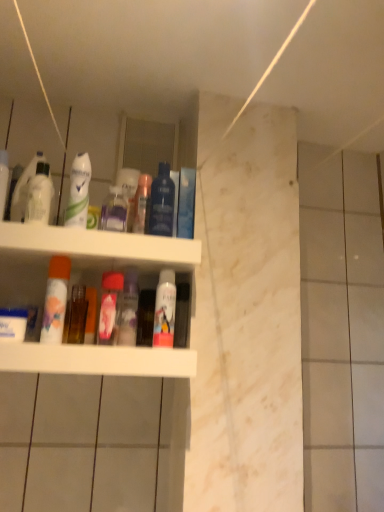
What do you see at coordinates (186, 203) in the screenshot? I see `blue glossy box at upper center, the 1th toiletry positioned from the right` at bounding box center [186, 203].

Where is `translucent plastic bottle at center, acting as the second toiletry starting from the left`? The image size is (384, 512). translucent plastic bottle at center, acting as the second toiletry starting from the left is located at coordinates (141, 203).

This screenshot has width=384, height=512. What do you see at coordinates (55, 300) in the screenshot?
I see `white glossy mouthwash at center, the 2th mouthwash viewed from the left` at bounding box center [55, 300].

This screenshot has width=384, height=512. I want to click on white glossy mouthwash at upper left, marked as the first mouthwash in a left-to-right arrangement, so coord(39,195).

The image size is (384, 512). In order to click on white plastic shelf at center in this screenshot , I will do 82,257.

This screenshot has height=512, width=384. What are the coordinates of `blue glossy box at upper center, the third toiletry when ordered from left to right` in the screenshot? It's located at (186, 203).

Is pink matte spray can at center, acting as the third toiletry starting from the right, bigger or smaller than white plastic shelf at center?

Considering their sizes, pink matte spray can at center, acting as the third toiletry starting from the right, takes up less space than white plastic shelf at center.

Visually, is pink matte spray can at center, acting as the third toiletry starting from the right, positioned to the left or to the right of white plastic shelf at center?

Based on their positions, pink matte spray can at center, acting as the third toiletry starting from the right, is located to the right of white plastic shelf at center.

Looking at this image, which of these two, pink matte spray can at center, which is the first toiletry in left-to-right order, or white plastic shelf at center, is thinner?

pink matte spray can at center, which is the first toiletry in left-to-right order.

Is point (31, 254) in front of point (117, 220)?

No.

Is white plastic shelf at center facing away from transparent plastic bottle at upper center, the 1th cleaning product when ordered from back to front?

No, white plastic shelf at center is not facing away from transparent plastic bottle at upper center, the 1th cleaning product when ordered from back to front.

Is white plastic shelf at center located outside transparent plastic bottle at upper center, positioned as the 1th cleaning product in right-to-left order?

Yes.

Does white plastic shelf at center have a larger size compared to transparent plastic bottle at upper center, the 2th cleaning product positioned from the left?

Indeed, white plastic shelf at center has a larger size compared to transparent plastic bottle at upper center, the 2th cleaning product positioned from the left.

Is transparent plastic bottle at upper center, the 2th cleaning product positioned from the left, located outside blue glossy mouthwash at upper center, acting as the 4th mouthwash starting from the left?

That's correct, transparent plastic bottle at upper center, the 2th cleaning product positioned from the left, is outside of blue glossy mouthwash at upper center, acting as the 4th mouthwash starting from the left.

Which object is more forward, transparent plastic bottle at upper center, placed as the second cleaning product when sorted from front to back, or blue glossy mouthwash at upper center, acting as the 4th mouthwash starting from the left?

blue glossy mouthwash at upper center, acting as the 4th mouthwash starting from the left, is more forward.

Which object is thinner, transparent plastic bottle at upper center, placed as the second cleaning product when sorted from front to back, or blue glossy mouthwash at upper center, acting as the 4th mouthwash starting from the left?

With smaller width is transparent plastic bottle at upper center, placed as the second cleaning product when sorted from front to back.

Does point (123, 200) come closer to viewer compared to point (157, 197)?

That is False.

Consider the image. From a real-world perspective, which object rests below the other?

In real-world perspective, pink matte spray can at center, which is the first toiletry in left-to-right order, is lower.

Would you say white glossy deodorant at upper left, which ranks as the first cleaning product in left-to-right order, is a long distance from pink matte spray can at center, which is the first toiletry in left-to-right order?

white glossy deodorant at upper left, which ranks as the first cleaning product in left-to-right order, is near pink matte spray can at center, which is the first toiletry in left-to-right order, not far away.

Would you say white glossy deodorant at upper left, the 2th cleaning product in the right-to-left sequence, is inside or outside pink matte spray can at center, acting as the third toiletry starting from the right?

The correct answer is: outside.

Locate an element on the screen. The width and height of the screenshot is (384, 512). the 1st cleaning product below the blue glossy box at upper center, the 1th toiletry positioned from the right (from a real-world perspective) is located at coordinates (78, 191).

Between white glossy deodorant at upper left, the 2th cleaning product in the right-to-left sequence, and blue glossy box at upper center, the third toiletry when ordered from left to right, which one is positioned in front?

Positioned in front is white glossy deodorant at upper left, the 2th cleaning product in the right-to-left sequence.

From a real-world perspective, between white glossy deodorant at upper left, the 2th cleaning product in the right-to-left sequence, and blue glossy box at upper center, the 1th toiletry positioned from the right, who is vertically lower?

From a 3D spatial view, white glossy deodorant at upper left, the 2th cleaning product in the right-to-left sequence, is below.

Is blue glossy box at upper center, the third toiletry when ordered from left to right, surrounded by white glossy deodorant at upper left, marked as the 1th cleaning product in a front-to-back arrangement?

No, blue glossy box at upper center, the third toiletry when ordered from left to right, is not surrounded by white glossy deodorant at upper left, marked as the 1th cleaning product in a front-to-back arrangement.

In order to click on the 1st mouthwash in front of the translucent plastic bottle at center, acting as the second toiletry starting from the left, starting your count from the anchor in this screenshot , I will do `click(39, 195)`.

From the image's perspective, which one is positioned lower, white glossy mouthwash at upper left, marked as the first mouthwash in a left-to-right arrangement, or translucent plastic bottle at center, the second toiletry from the right?

translucent plastic bottle at center, the second toiletry from the right, is shown below in the image.

What's the angular difference between white glossy mouthwash at upper left, which is the fifth mouthwash from right to left, and translucent plastic bottle at center, the second toiletry from the right,'s facing directions?

The facing directions of white glossy mouthwash at upper left, which is the fifth mouthwash from right to left, and translucent plastic bottle at center, the second toiletry from the right, are 6.64e-05 degrees apart.

Is white glossy mouthwash at upper left, which is the fifth mouthwash from right to left, touching translucent plastic bottle at center, acting as the second toiletry starting from the left?

A: There is a gap between white glossy mouthwash at upper left, which is the fifth mouthwash from right to left, and translucent plastic bottle at center, acting as the second toiletry starting from the left.

From the image's perspective, between white glossy mouthwash at center, which ranks as the 4th mouthwash in right-to-left order, and white glossy deodorant at upper left, acting as the second cleaning product starting from the back, who is located below?

white glossy mouthwash at center, which ranks as the 4th mouthwash in right-to-left order, from the image's perspective.

Looking at this image, from a real-world perspective, does white glossy mouthwash at center, the 2th mouthwash viewed from the left, stand above white glossy deodorant at upper left, marked as the 1th cleaning product in a front-to-back arrangement?

No.

Locate an element on the screen. mouthwash that is the 1st one when counting forward from the white glossy deodorant at upper left, acting as the second cleaning product starting from the back is located at coordinates (55, 300).

Which is more to the left, white glossy mouthwash at center, which ranks as the 4th mouthwash in right-to-left order, or white glossy deodorant at upper left, the 2th cleaning product in the right-to-left sequence?

From the viewer's perspective, white glossy mouthwash at center, which ranks as the 4th mouthwash in right-to-left order, appears more on the left side.

Which toiletry is the 1st one when counting from the right side of the white plastic shelf at center? Please provide its 2D coordinates.

[(129, 310)]

Where is `the 1st cleaning product directly above the white plastic shelf at center (from a real-world perspective)`? Image resolution: width=384 pixels, height=512 pixels. the 1st cleaning product directly above the white plastic shelf at center (from a real-world perspective) is located at coordinates (114, 211).

Considering their positions, is transparent plastic bottle at upper center, positioned as the 1th cleaning product in right-to-left order, positioned further to translucent plastic bottle at center, acting as the second toiletry starting from the left, than blue glossy mouthwash at upper center, acting as the 4th mouthwash starting from the left?

The object further to translucent plastic bottle at center, acting as the second toiletry starting from the left, is transparent plastic bottle at upper center, positioned as the 1th cleaning product in right-to-left order.

From the picture: Which object lies nearer to the anchor point blue glossy mouthwash at upper center, acting as the 4th mouthwash starting from the left, pink glossy mouthwash at center, the third mouthwash viewed from the left, or white glossy mouthwash at upper left, which is the fifth mouthwash from right to left?

The object closer to blue glossy mouthwash at upper center, acting as the 4th mouthwash starting from the left, is pink glossy mouthwash at center, the third mouthwash viewed from the left.

Estimate the real-world distances between objects in this image. Which object is further from translucent plastic bottle at center, the second toiletry from the right, pink glossy mouthwash at center, the third mouthwash viewed from the left, or white glossy mouthwash at center, the 2th mouthwash viewed from the left?

The object further to translucent plastic bottle at center, the second toiletry from the right, is white glossy mouthwash at center, the 2th mouthwash viewed from the left.

Considering their positions, is blue glossy box at upper center, the 1th toiletry positioned from the right, positioned closer to white matte mouthwash at center, which appears as the first mouthwash when viewed from the right, than pink matte spray can at center, which is the first toiletry in left-to-right order?

pink matte spray can at center, which is the first toiletry in left-to-right order, is positioned closer to the anchor white matte mouthwash at center, which appears as the first mouthwash when viewed from the right.

Looking at the image, which one is located further to blue glossy box at upper center, the 1th toiletry positioned from the right, transparent plastic bottle at upper center, the 2th cleaning product positioned from the left, or translucent plastic bottle at center, acting as the second toiletry starting from the left?

transparent plastic bottle at upper center, the 2th cleaning product positioned from the left, is further to blue glossy box at upper center, the 1th toiletry positioned from the right.

Estimate the real-world distances between objects in this image. Which object is closer to transparent plastic bottle at upper center, the 2th cleaning product positioned from the left, blue glossy box at upper center, the 1th toiletry positioned from the right, or pink matte spray can at center, which is the first toiletry in left-to-right order?

blue glossy box at upper center, the 1th toiletry positioned from the right, lies closer to transparent plastic bottle at upper center, the 2th cleaning product positioned from the left, than the other object.

From the image, which object appears to be nearer to transparent plastic bottle at upper center, the 1th cleaning product when ordered from back to front, translucent plastic bottle at center, the second toiletry from the right, or pink glossy mouthwash at center, which ranks as the third mouthwash in right-to-left order?

Based on the image, translucent plastic bottle at center, the second toiletry from the right, appears to be nearer to transparent plastic bottle at upper center, the 1th cleaning product when ordered from back to front.

From the image, which object appears to be nearer to translucent plastic bottle at center, acting as the second toiletry starting from the left, transparent plastic bottle at upper center, the 2th cleaning product positioned from the left, or white plastic shelf at center?

Among the two, transparent plastic bottle at upper center, the 2th cleaning product positioned from the left, is located nearer to translucent plastic bottle at center, acting as the second toiletry starting from the left.

You are a GUI agent. You are given a task and a screenshot of the screen. Output one action in this format:
    pyautogui.click(x=<x>, y=<y>)
    Task: Click on the cleaning product between translucent plastic bottle at center, acting as the second toiletry starting from the left, and pink matte spray can at center, acting as the third toiletry starting from the right, from top to bottom
    The height and width of the screenshot is (512, 384).
    Given the screenshot: What is the action you would take?
    pyautogui.click(x=114, y=211)

Where is `mouthwash between translucent plastic bottle at center, acting as the second toiletry starting from the left, and pink glossy mouthwash at center, which ranks as the third mouthwash in right-to-left order, in the vertical direction`? The image size is (384, 512). mouthwash between translucent plastic bottle at center, acting as the second toiletry starting from the left, and pink glossy mouthwash at center, which ranks as the third mouthwash in right-to-left order, in the vertical direction is located at coordinates (55, 300).

At what (x,y) coordinates should I click in order to perform the action: click on cleaning product between white glossy deodorant at upper left, the 2th cleaning product in the right-to-left sequence, and translucent plastic bottle at center, the second toiletry from the right, in the horizontal direction. Please return your answer as a coordinate pair (x, y). The width and height of the screenshot is (384, 512). Looking at the image, I should click on (114, 211).

This screenshot has height=512, width=384. I want to click on shelf located between white glossy mouthwash at center, the 2th mouthwash viewed from the left, and blue glossy box at upper center, the 1th toiletry positioned from the right, in the left-right direction, so click(x=82, y=257).